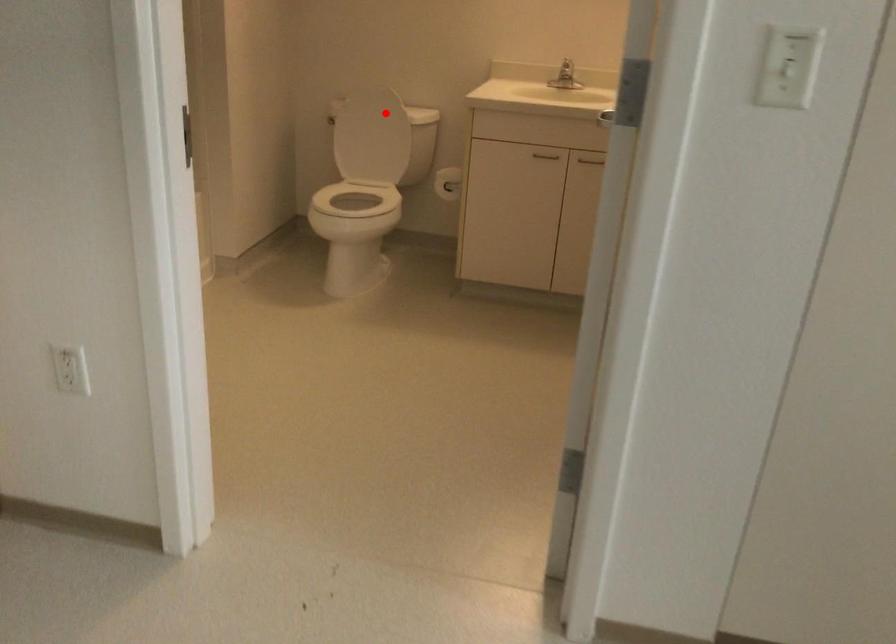
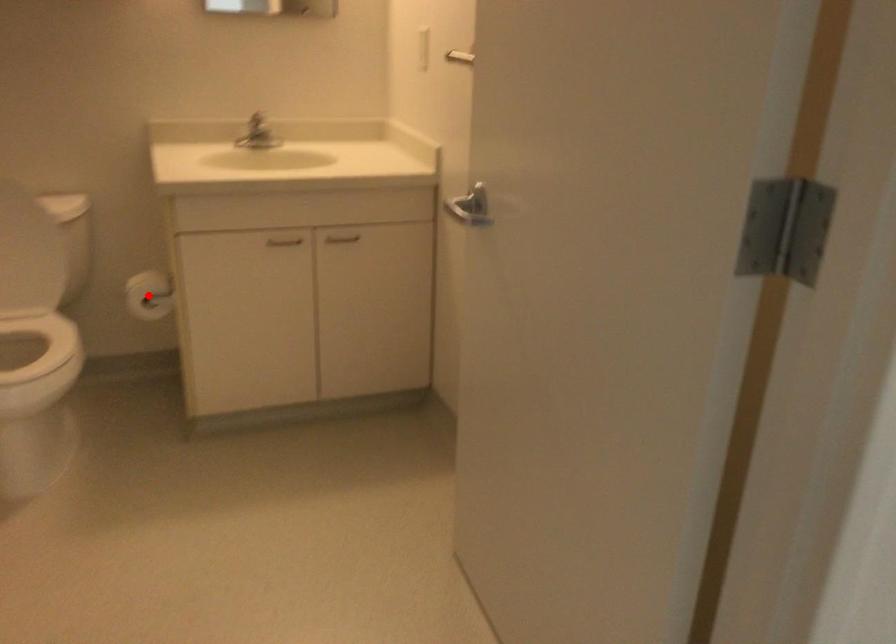
I am providing you with two images of the same scene from different viewpoints. A red point is marked on the first image and another point is marked on the second image. Is the marked point in image1 the same physical position as the marked point in image2?

No